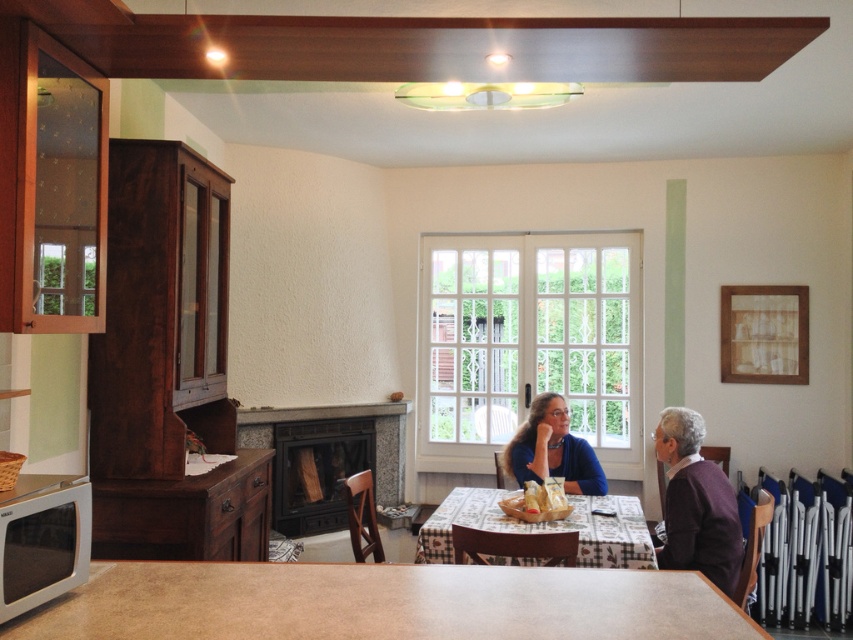
Question: From the image, what is the correct spatial relationship of smooth beige table at center in relation to shiny plastic bag at table center?

Choices:
 (A) below
 (B) above

Answer: (B)

Question: Is patterned fabric table at center wider than matte blue sweater at center?

Choices:
 (A) no
 (B) yes

Answer: (B)

Question: Among these objects, which one is farthest from the camera?

Choices:
 (A) matte purple sweater at center
 (B) matte blue sweater at center
 (C) silver metallic microwave at lower left
 (D) purple wool sweater at right

Answer: (B)

Question: Which point is closer to the camera?

Choices:
 (A) (579, 444)
 (B) (440, 561)
 (C) (724, 522)

Answer: (C)

Question: Can you confirm if smooth beige table at center is positioned to the right of silver metallic microwave at lower left?

Choices:
 (A) no
 (B) yes

Answer: (B)

Question: Which of the following is the closest to the observer?

Choices:
 (A) (534, 518)
 (B) (421, 536)
 (C) (659, 442)
 (D) (688, 612)

Answer: (D)